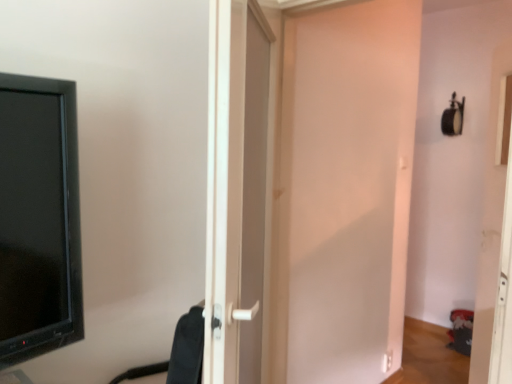
Question: Would you say white matte door at center, the second door positioned from the left, is outside black fabric swivel chair at center?

Choices:
 (A) no
 (B) yes

Answer: (B)

Question: Considering the relative sizes of white matte door at center, the second door positioned from the left, and black fabric swivel chair at center in the image provided, is white matte door at center, the second door positioned from the left, thinner than black fabric swivel chair at center?

Choices:
 (A) no
 (B) yes

Answer: (B)

Question: Considering the relative positions of white matte door at center, the second door positioned from the left, and black fabric swivel chair at center in the image provided, is white matte door at center, the second door positioned from the left, behind black fabric swivel chair at center?

Choices:
 (A) yes
 (B) no

Answer: (A)

Question: Is white matte door at center, marked as the 1th door in a right-to-left arrangement, smaller than black fabric swivel chair at center?

Choices:
 (A) yes
 (B) no

Answer: (B)

Question: From the image's perspective, is white matte door at center, the second door positioned from the left, located beneath black fabric swivel chair at center?

Choices:
 (A) no
 (B) yes

Answer: (A)

Question: From a real-world perspective, is white matte door at center, marked as the 1th door in a right-to-left arrangement, located higher than black fabric swivel chair at center?

Choices:
 (A) yes
 (B) no

Answer: (A)

Question: Can you confirm if white plastic door at center, which is the 1th door in left-to-right order, is smaller than white matte door at center, the second door positioned from the left?

Choices:
 (A) no
 (B) yes

Answer: (A)

Question: Is white plastic door at center, which is the 1th door in left-to-right order, wider than white matte door at center, the second door positioned from the left?

Choices:
 (A) yes
 (B) no

Answer: (A)

Question: Considering the relative sizes of white plastic door at center, which appears as the second door when viewed from the right, and white matte door at center, marked as the 1th door in a right-to-left arrangement, in the image provided, is white plastic door at center, which appears as the second door when viewed from the right, thinner than white matte door at center, marked as the 1th door in a right-to-left arrangement,?

Choices:
 (A) no
 (B) yes

Answer: (A)

Question: Would you say white matte door at center, the second door positioned from the left, is part of white plastic door at center, which is the 1th door in left-to-right order,'s contents?

Choices:
 (A) yes
 (B) no

Answer: (B)

Question: Does white plastic door at center, which is the 1th door in left-to-right order, appear on the right side of white matte door at center, the second door positioned from the left?

Choices:
 (A) yes
 (B) no

Answer: (B)

Question: Does white plastic door at center, which appears as the second door when viewed from the right, appear on the left side of white matte door at center, marked as the 1th door in a right-to-left arrangement?

Choices:
 (A) no
 (B) yes

Answer: (B)

Question: Is white matte door at center, the second door positioned from the left, oriented away from white plastic door at center, which appears as the second door when viewed from the right?

Choices:
 (A) yes
 (B) no

Answer: (A)